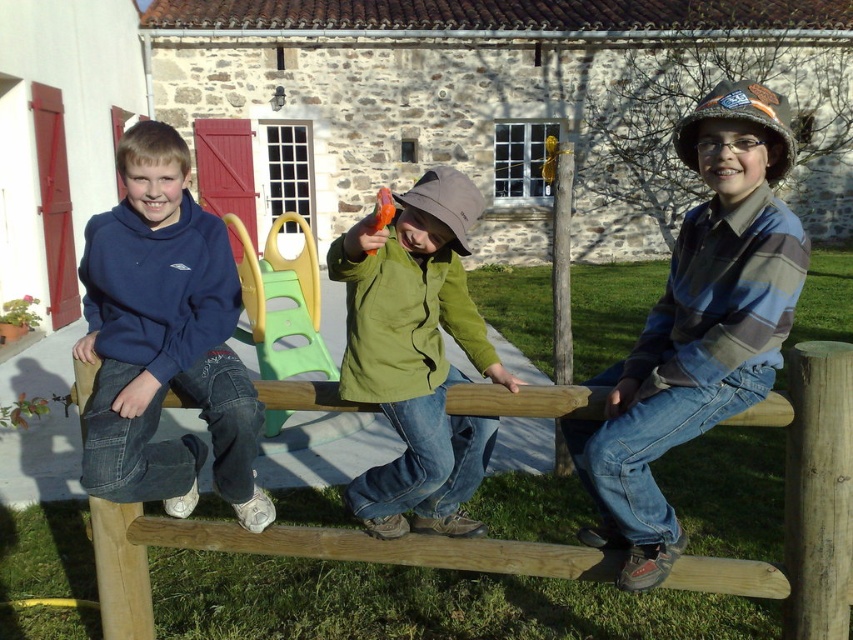
Is striped flannel shirt at right to the left of green matte jacket at center from the viewer's perspective?

Incorrect, striped flannel shirt at right is not on the left side of green matte jacket at center.

Who is taller, striped flannel shirt at right or green matte jacket at center?

With more height is striped flannel shirt at right.

In order to click on striped flannel shirt at right in this screenshot , I will do `click(698, 324)`.

At what (x,y) coordinates should I click in order to perform the action: click on striped flannel shirt at right. Please return your answer as a coordinate pair (x, y). The height and width of the screenshot is (640, 853). Looking at the image, I should click on (698, 324).

Can you confirm if wooden at center is smaller than matte blue hoodie at left?

No, wooden at center is not smaller than matte blue hoodie at left.

Is point (122, 518) less distant than point (148, 232)?

No.

Between point (488, 397) and point (175, 445), which one is positioned behind?

The point (175, 445) is more distant.

You are a GUI agent. You are given a task and a screenshot of the screen. Output one action in this format:
    pyautogui.click(x=<x>, y=<y>)
    Task: Click on the wooden at center
    The width and height of the screenshot is (853, 640).
    Given the screenshot: What is the action you would take?
    pos(801,500)

Does striped flannel shirt at right come behind green plastic slide at center?

No, striped flannel shirt at right is closer to the viewer.

At what (x,y) coordinates should I click in order to perform the action: click on striped flannel shirt at right. Please return your answer as a coordinate pair (x, y). This screenshot has width=853, height=640. Looking at the image, I should click on (698, 324).

You are a GUI agent. You are given a task and a screenshot of the screen. Output one action in this format:
    pyautogui.click(x=<x>, y=<y>)
    Task: Click on the striped flannel shirt at right
    Image resolution: width=853 pixels, height=640 pixels.
    Given the screenshot: What is the action you would take?
    698,324